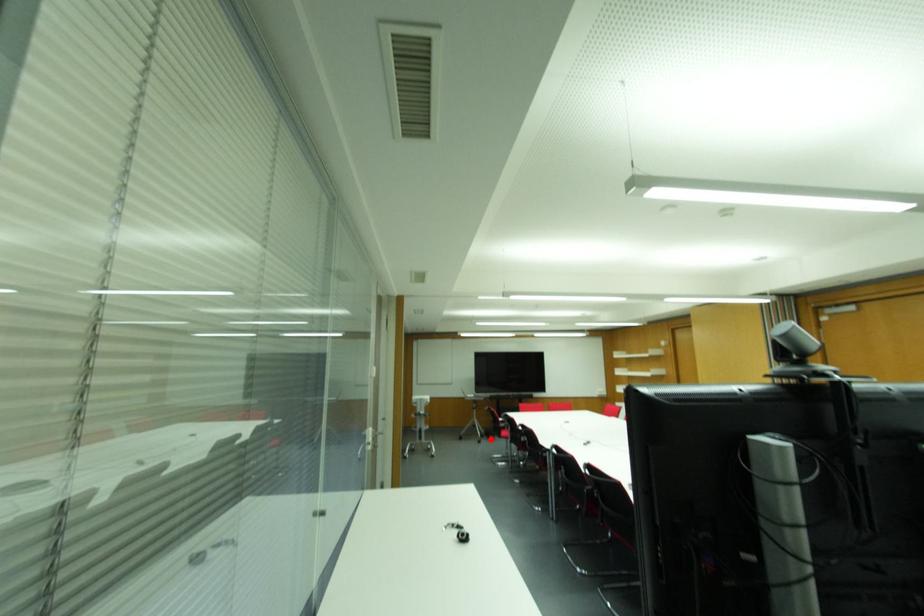
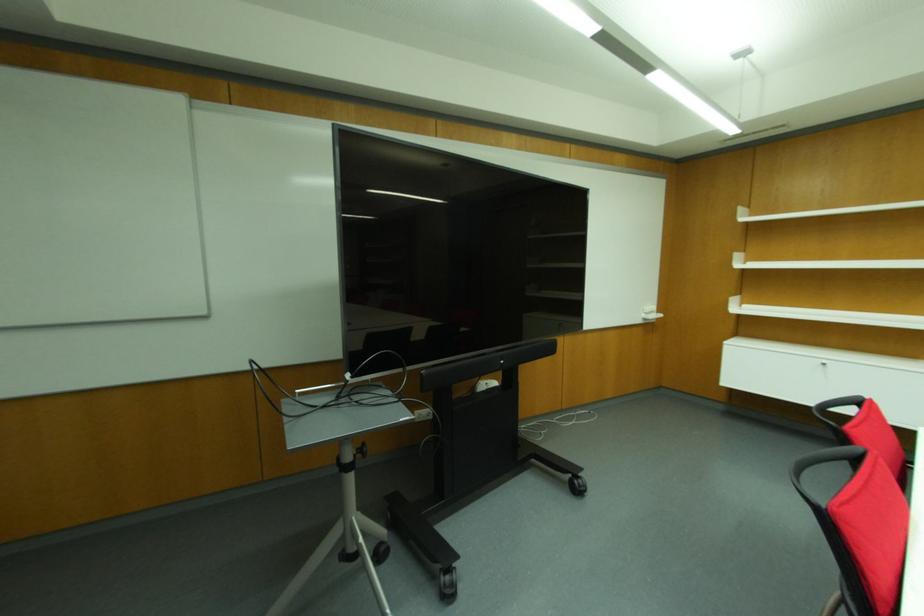
Question: I am providing you with two images of the same scene from different viewpoints. A red point is shown in image1. For the corresponding object point in image2, is it positioned nearer or farther from the camera?

Choices:
 (A) Nearer
 (B) Farther

Answer: (A)